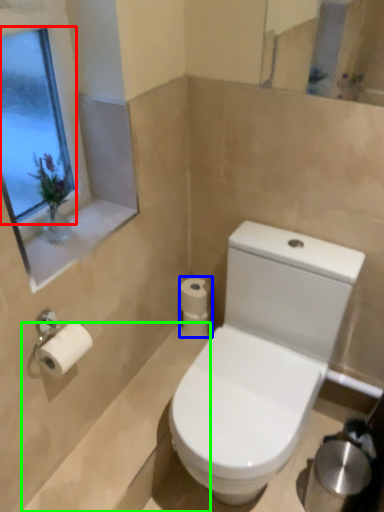
Question: Based on their relative distances, which object is farther from window screen (highlighted by a red box)? Choose from toilet paper (highlighted by a blue box) and bath (highlighted by a green box).

Choices:
 (A) toilet paper
 (B) bath

Answer: (B)